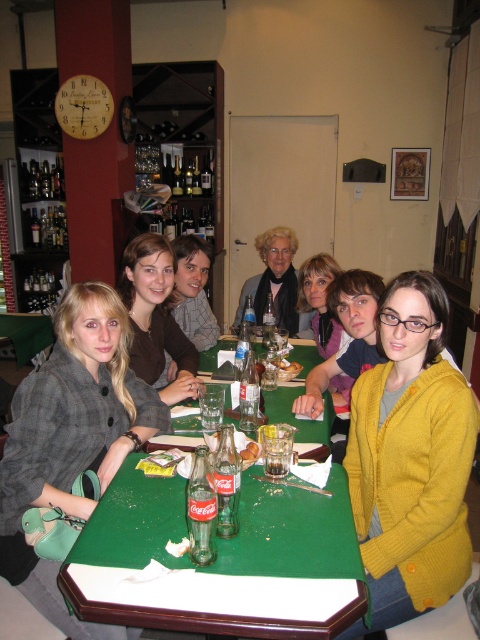
Based on the photo, which of these two, brown wool sweater at center or green fabric table at lower left, stands shorter?

green fabric table at lower left

Between point (164, 337) and point (31, 353), which one is positioned in front?

Point (164, 337) is in front.

The width and height of the screenshot is (480, 640). What are the coordinates of `brown wool sweater at center` in the screenshot? It's located at [x=156, y=316].

In the scene shown: Who is positioned more to the right, matte black scarf at center or yellow matte bread at table center?

From the viewer's perspective, matte black scarf at center appears more on the right side.

Based on the photo, is the position of matte black scarf at center more distant than that of yellow matte bread at table center?

That is True.

Identify the location of matte black scarf at center. (276, 280).

Where is `matte black scarf at center`? matte black scarf at center is located at coordinates (276, 280).

Does brown wool sweater at center appear on the left side of matte purple sweater at center?

Yes, brown wool sweater at center is to the left of matte purple sweater at center.

Describe the element at coordinates (156, 316) in the screenshot. I see `brown wool sweater at center` at that location.

In order to click on brown wool sweater at center in this screenshot , I will do 156,316.